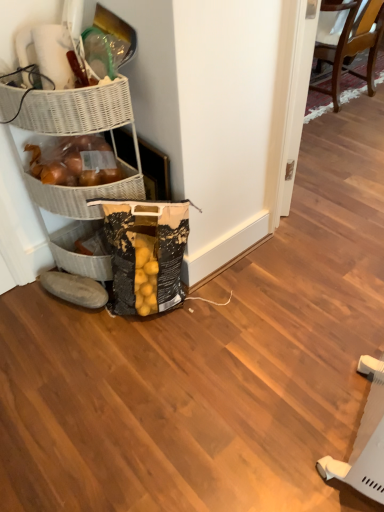
Locate an element on the screen. This screenshot has height=512, width=384. vacant space in front of black textured grocery bag at lower left is located at coordinates pyautogui.click(x=149, y=356).